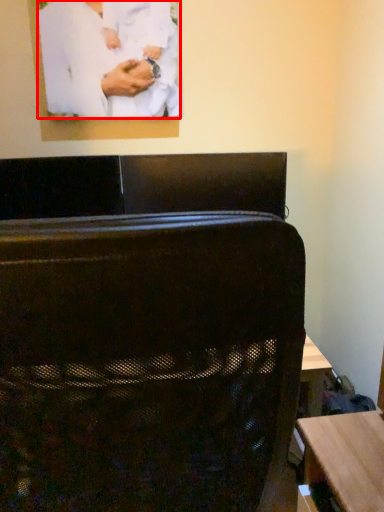
Question: From the image's perspective, considering the relative positions of person (annotated by the red box) and furniture in the image provided, where is person (annotated by the red box) located with respect to the staircase?

Choices:
 (A) above
 (B) below

Answer: (A)